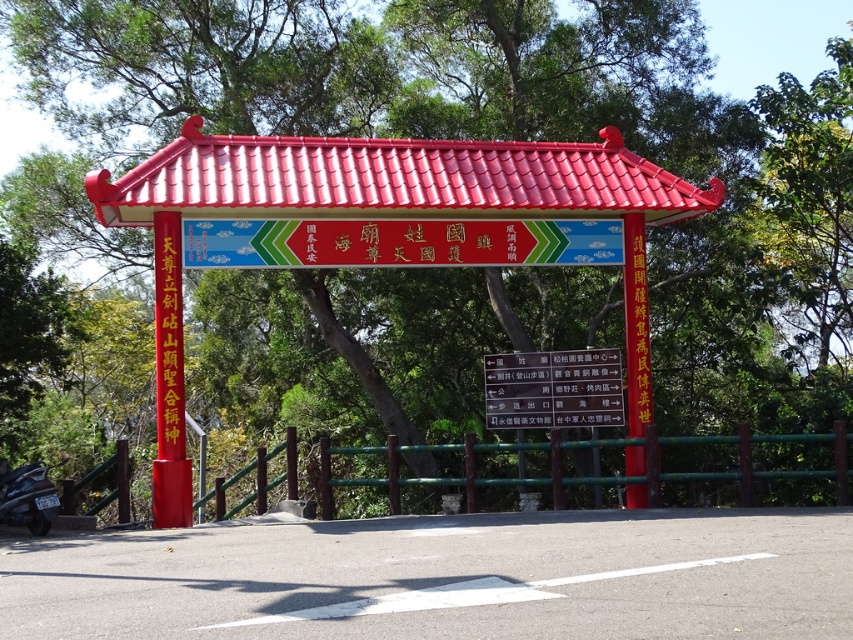
Who is positioned more to the right, red tile roof at center or black matte motorcycle at lower left?

red tile roof at center is more to the right.

Does point (398, 188) lie in front of point (21, 506)?

No, (398, 188) is behind (21, 506).

The width and height of the screenshot is (853, 640). What are the coordinates of `red tile roof at center` in the screenshot? It's located at (393, 179).

Which of these two, shiny red gazebo at center or red tile roof at center, stands taller?

Standing taller between the two is shiny red gazebo at center.

Can you confirm if shiny red gazebo at center is positioned to the left of red tile roof at center?

Incorrect, shiny red gazebo at center is not on the left side of red tile roof at center.

I want to click on shiny red gazebo at center, so click(x=386, y=227).

Is point (364, 259) positioned after point (602, 362)?

No, (364, 259) is closer to viewer.

Between matte red signboard at center and white paper sign at center, which one is positioned lower?

white paper sign at center is lower down.

Locate an element on the screen. The height and width of the screenshot is (640, 853). matte red signboard at center is located at coordinates (399, 243).